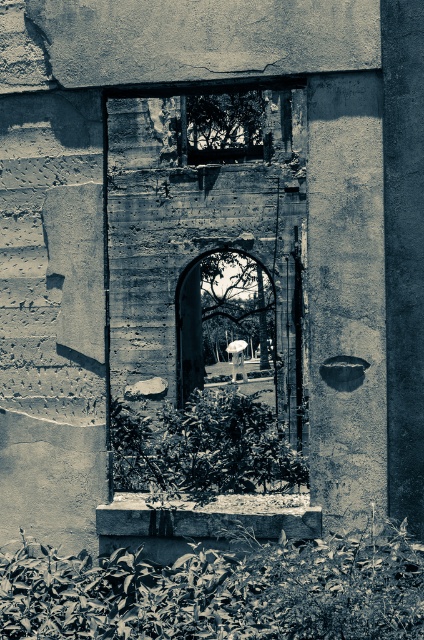
Question: Can you confirm if leathery green leaves at lower center is positioned above transparent glass window at upper center?

Choices:
 (A) no
 (B) yes

Answer: (A)

Question: Is leathery green leaves at lower center below smooth stone archway at center?

Choices:
 (A) no
 (B) yes

Answer: (B)

Question: Does leathery green leaves at lower center appear under transparent glass window at upper center?

Choices:
 (A) yes
 (B) no

Answer: (A)

Question: Which point is farther from the camera taking this photo?

Choices:
 (A) (86, 604)
 (B) (265, 292)
 (C) (203, 99)

Answer: (B)

Question: Among these objects, which one is nearest to the camera?

Choices:
 (A) smooth stone archway at center
 (B) leathery green leaves at lower center
 (C) green leafy plant at center
 (D) transparent glass window at upper center

Answer: (B)

Question: Which point is closer to the camera?

Choices:
 (A) pos(253,321)
 (B) pos(21,570)
 (C) pos(200,410)
 (D) pos(197,122)

Answer: (B)